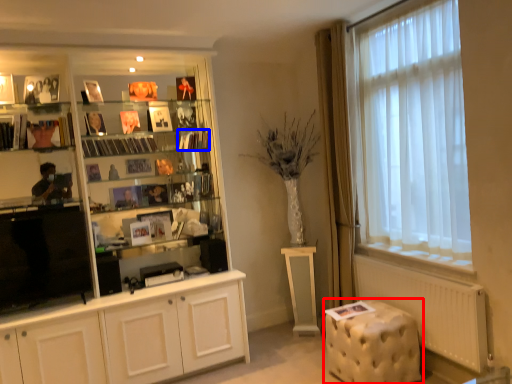
Question: Which object is closer to the camera taking this photo, music stool (highlighted by a red box) or book (highlighted by a blue box)?

Choices:
 (A) music stool
 (B) book

Answer: (A)